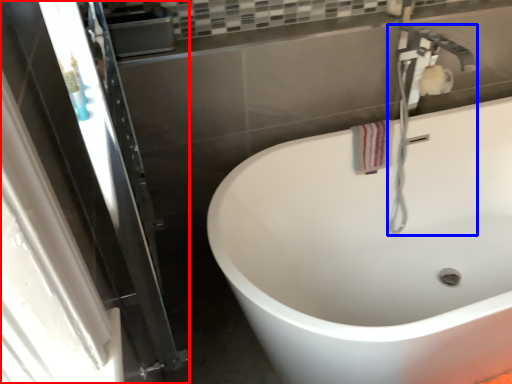
Question: Among these objects, which one is nearest to the camera, screen door (highlighted by a red box) or plumbing fixture (highlighted by a blue box)?

Choices:
 (A) screen door
 (B) plumbing fixture

Answer: (A)